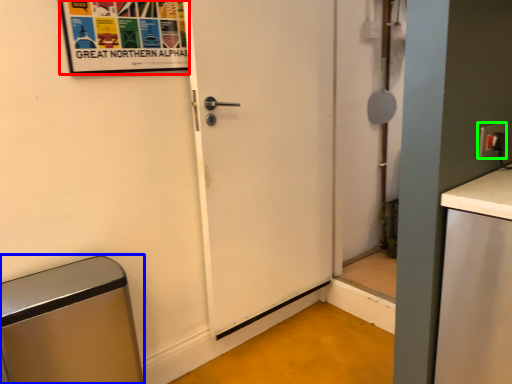
Question: Which is farther away from poster (highlighted by a red box)? appliance (highlighted by a blue box) or electric outlet (highlighted by a green box)?

Choices:
 (A) appliance
 (B) electric outlet

Answer: (B)